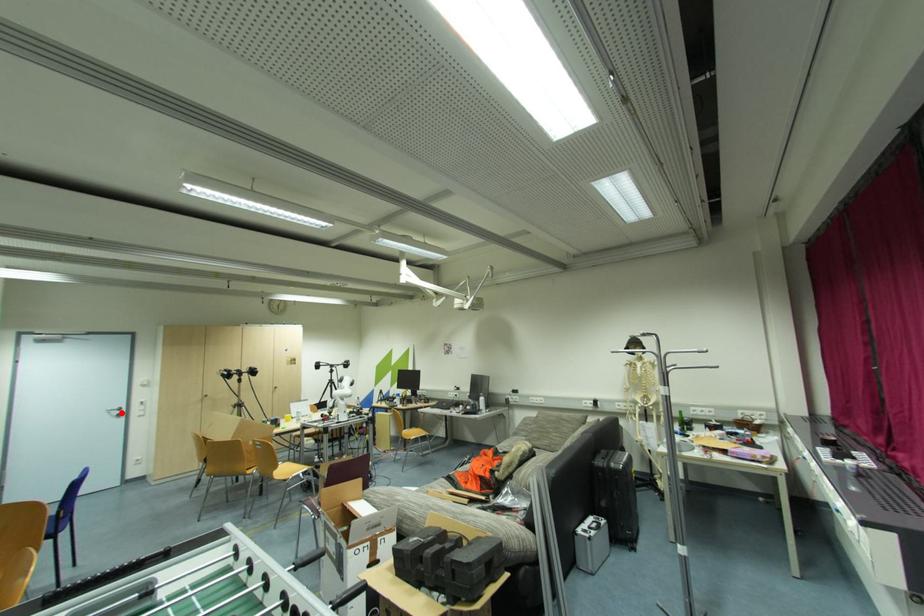
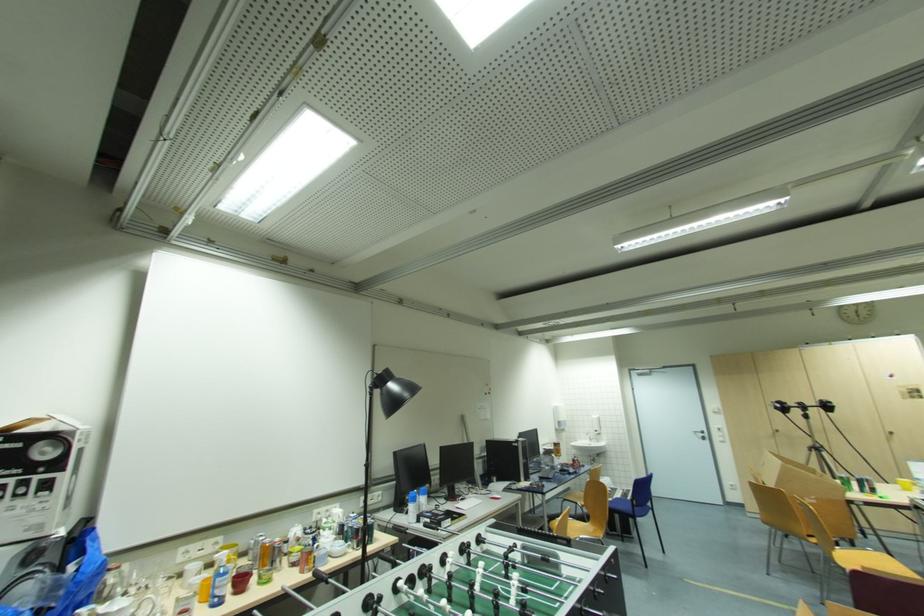
The point at the highlighted location is marked in the first image. Where is the corresponding point in the second image?

(706, 436)